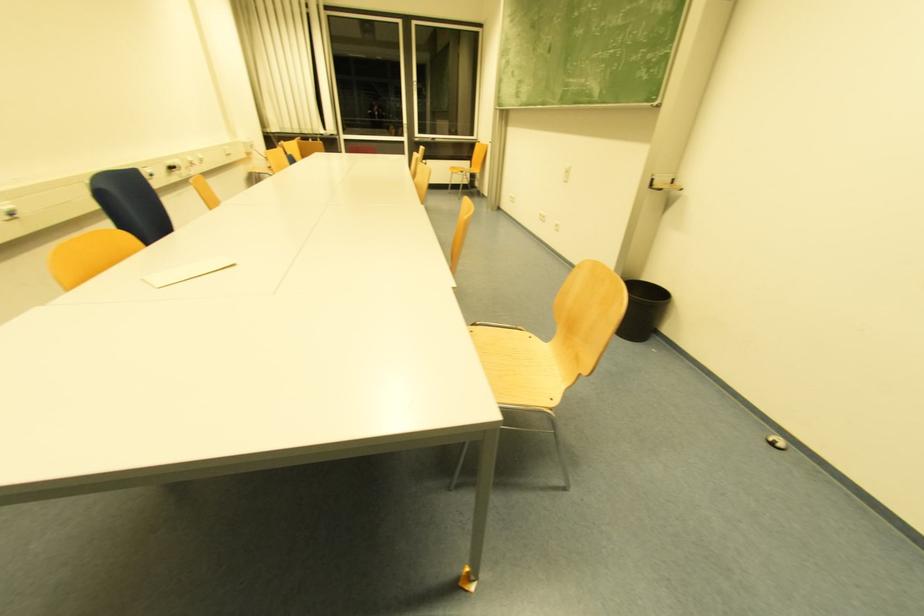
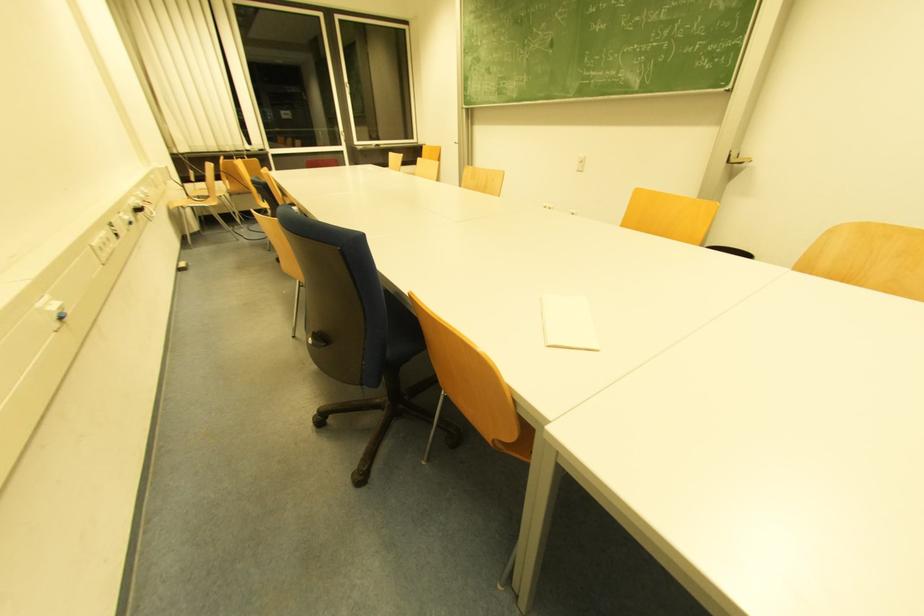
Question: In a continuous first-person perspective shot, in which direction is the camera moving?

Choices:
 (A) Left
 (B) Right
 (C) Forward
 (D) Backward

Answer: (A)